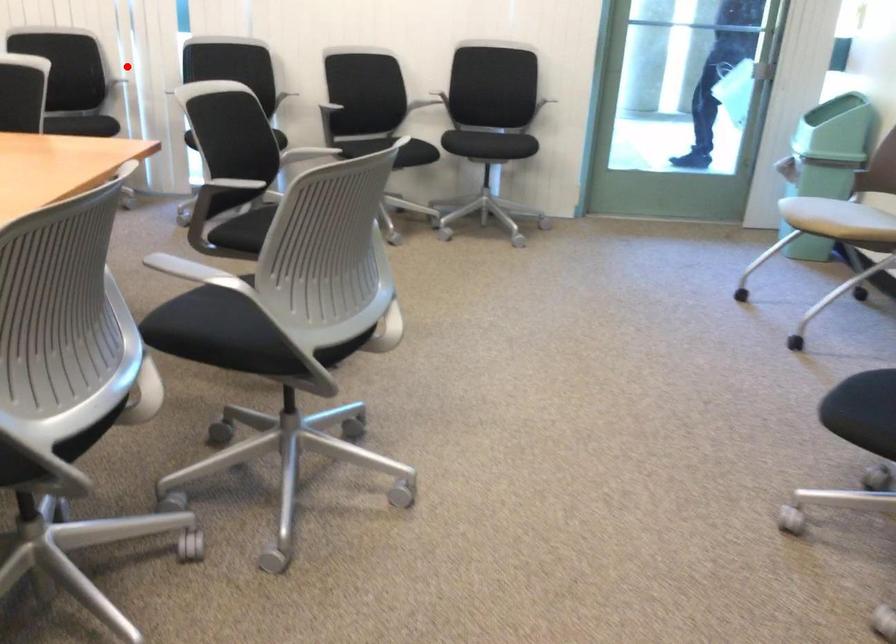
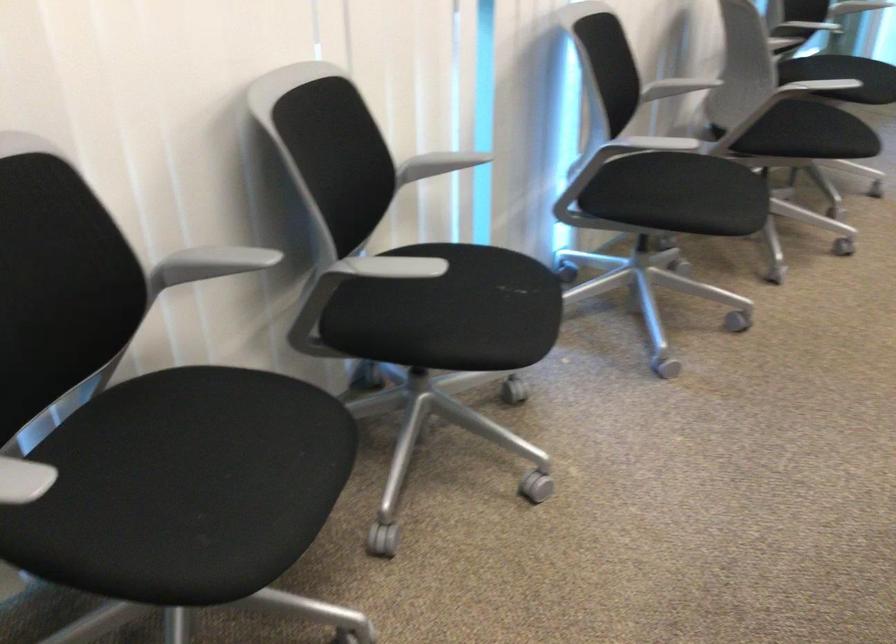
Question: I am providing you with two images of the same scene from different viewpoints. A red point is marked on the first image. Can you still see the location of the red point in image 2?

Choices:
 (A) Yes
 (B) No

Answer: (A)